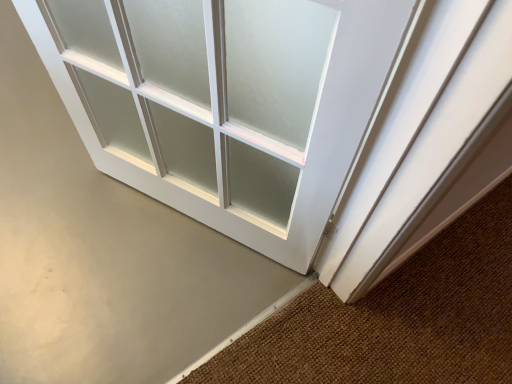
Question: From the image's perspective, would you say white frosted glass door at center is shown under brown textured doormat at lower right?

Choices:
 (A) no
 (B) yes

Answer: (A)

Question: Is brown textured doormat at lower right a part of white frosted glass door at center?

Choices:
 (A) no
 (B) yes

Answer: (A)

Question: Is white frosted glass door at center wider than brown textured doormat at lower right?

Choices:
 (A) yes
 (B) no

Answer: (A)

Question: Is white frosted glass door at center facing away from brown textured doormat at lower right?

Choices:
 (A) no
 (B) yes

Answer: (A)

Question: From the image's perspective, is white frosted glass door at center located above brown textured doormat at lower right?

Choices:
 (A) no
 (B) yes

Answer: (B)

Question: Can you confirm if white frosted glass door at center is shorter than brown textured doormat at lower right?

Choices:
 (A) no
 (B) yes

Answer: (A)

Question: Is brown textured doormat at lower right aimed at white frosted glass door at center?

Choices:
 (A) yes
 (B) no

Answer: (A)

Question: Does brown textured doormat at lower right have a lesser height compared to white frosted glass door at center?

Choices:
 (A) yes
 (B) no

Answer: (A)

Question: Is brown textured doormat at lower right at the right side of white frosted glass door at center?

Choices:
 (A) yes
 (B) no

Answer: (A)

Question: Can you confirm if brown textured doormat at lower right is wider than white frosted glass door at center?

Choices:
 (A) no
 (B) yes

Answer: (A)

Question: Is brown textured doormat at lower right smaller than white frosted glass door at center?

Choices:
 (A) no
 (B) yes

Answer: (B)

Question: Does brown textured doormat at lower right come behind white frosted glass door at center?

Choices:
 (A) no
 (B) yes

Answer: (A)

Question: Is brown textured doormat at lower right situated inside white frosted glass door at center or outside?

Choices:
 (A) outside
 (B) inside

Answer: (A)